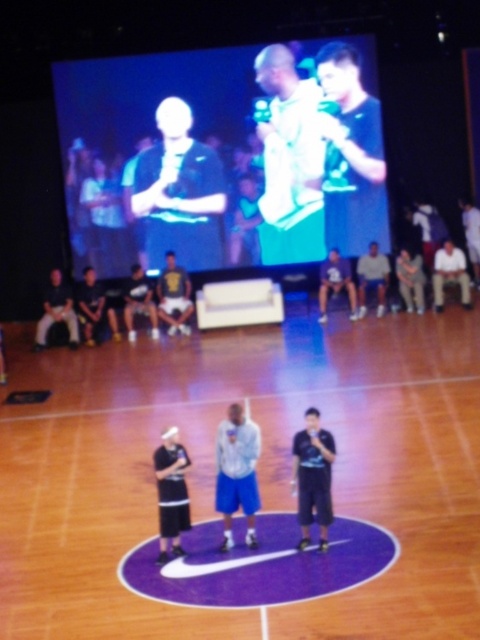
Question: Can you confirm if wooden floor at center is smaller than dark blue shirt at center?

Choices:
 (A) no
 (B) yes

Answer: (A)

Question: Estimate the real-world distances between objects in this image. Which object is farther from the matte black shirt at center?

Choices:
 (A) dark gray fabric cap at center
 (B) wooden floor at center
 (C) white matte jersey at center
 (D) dark blue shirt at center

Answer: (D)

Question: Which of the following is the closest to the observer?

Choices:
 (A) (298, 476)
 (B) (233, 417)

Answer: (A)

Question: Can you confirm if wooden floor at center is positioned to the right of dark gray fabric cap at center?

Choices:
 (A) yes
 (B) no

Answer: (A)

Question: Is the position of light blue fabric shorts at center more distant than that of dark blue shirt at center?

Choices:
 (A) no
 (B) yes

Answer: (B)

Question: Estimate the real-world distances between objects in this image. Which object is closer to the dark gray fabric cap at center?

Choices:
 (A) wooden floor at center
 (B) white matte jersey at center
 (C) matte black shirt at center
 (D) light blue fabric shorts at center

Answer: (D)